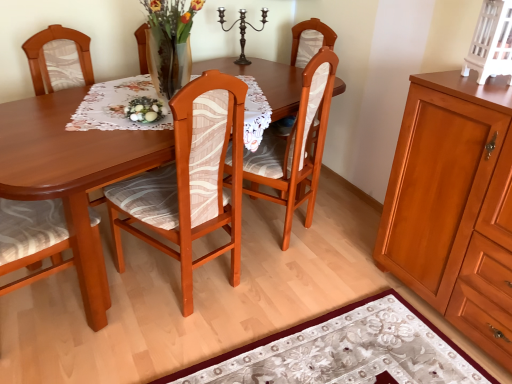
Where is `free point in front of wooden chair at center, the second chair in the left-to-right sequence`? This screenshot has width=512, height=384. free point in front of wooden chair at center, the second chair in the left-to-right sequence is located at coordinates (165, 343).